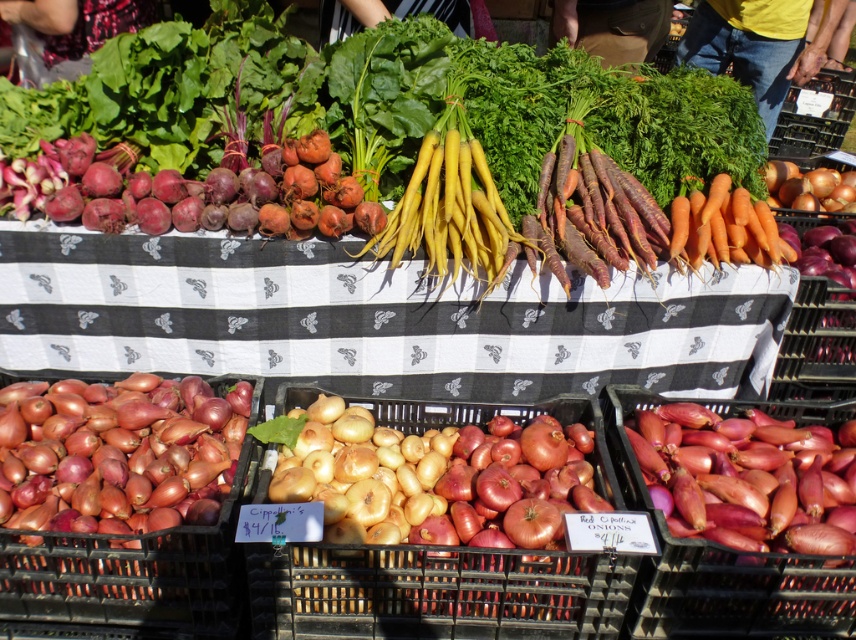
You are at the farmer market and see the shiny red onion at lower left and the orange matte carrots at upper right. Which one is positioned to the left of the other?

The shiny red onion at lower left is positioned to the left of the orange matte carrots at upper right.